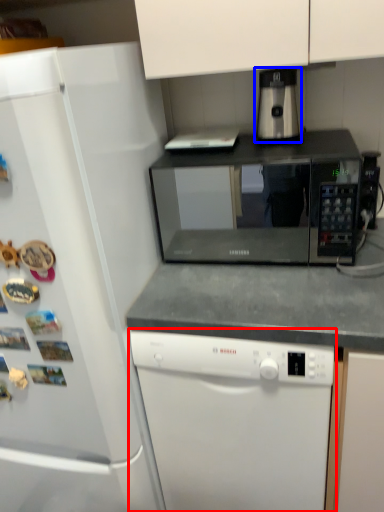
Question: Which object is closer to the camera taking this photo, dishwasher (highlighted by a red box) or coffee machine (highlighted by a blue box)?

Choices:
 (A) dishwasher
 (B) coffee machine

Answer: (A)